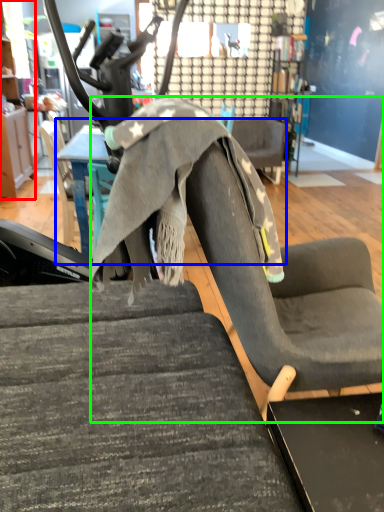
Question: Considering the real-world distances, which object is farthest from cabinetry (highlighted by a red box)? table (highlighted by a blue box) or swivel chair (highlighted by a green box)?

Choices:
 (A) table
 (B) swivel chair

Answer: (B)